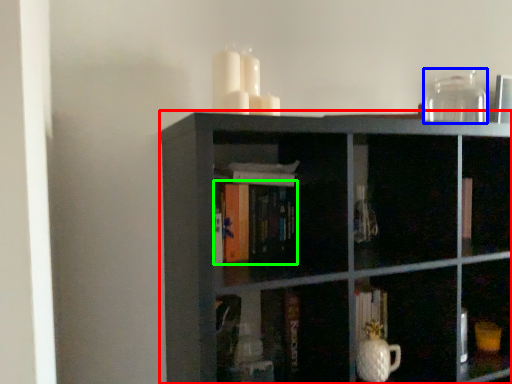
Question: Considering the real-world distances, which object is farthest from shelf (highlighted by a red box)? glass vase (highlighted by a blue box) or book (highlighted by a green box)?

Choices:
 (A) glass vase
 (B) book

Answer: (A)